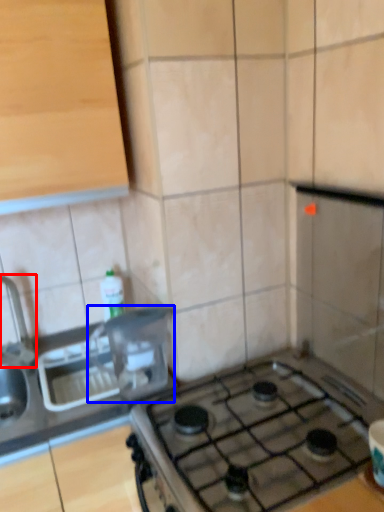
Question: Which object appears closest to the camera in this image, faucet (highlighted by a red box) or appliance (highlighted by a blue box)?

Choices:
 (A) faucet
 (B) appliance

Answer: (B)